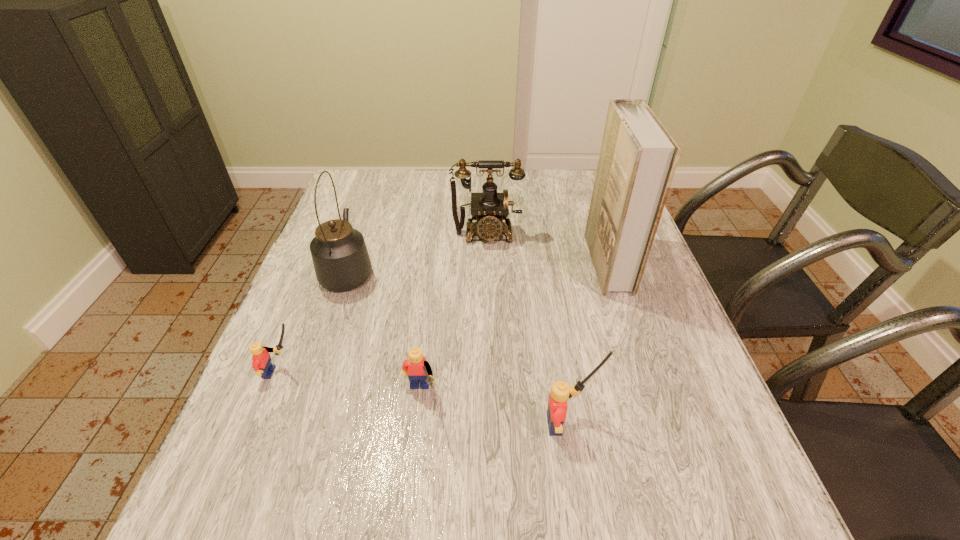
You are a GUI agent. You are given a task and a screenshot of the screen. Output one action in this format:
    pyautogui.click(x=<x>, y=<y>)
    Task: Click on the object that can be found as the fourth closest to the kettle
    The image size is (960, 540).
    Given the screenshot: What is the action you would take?
    pyautogui.click(x=560, y=392)

Point out which object is positioned as the fourth nearest to the tallest object. Please provide its 2D coordinates. Your answer should be formatted as a tuple, i.e. [(x, y)], where the tuple contains the x and y coordinates of a point satisfying the conditions above.

[(341, 261)]

Identify which Lego is the third nearest to the rightmost object. Please provide its 2D coordinates. Your answer should be formatted as a tuple, i.e. [(x, y)], where the tuple contains the x and y coordinates of a point satisfying the conditions above.

[(262, 364)]

Locate which Lego ranks third in proximity to the fourth object from left to right. Please provide its 2D coordinates. Your answer should be formatted as a tuple, i.e. [(x, y)], where the tuple contains the x and y coordinates of a point satisfying the conditions above.

[(560, 392)]